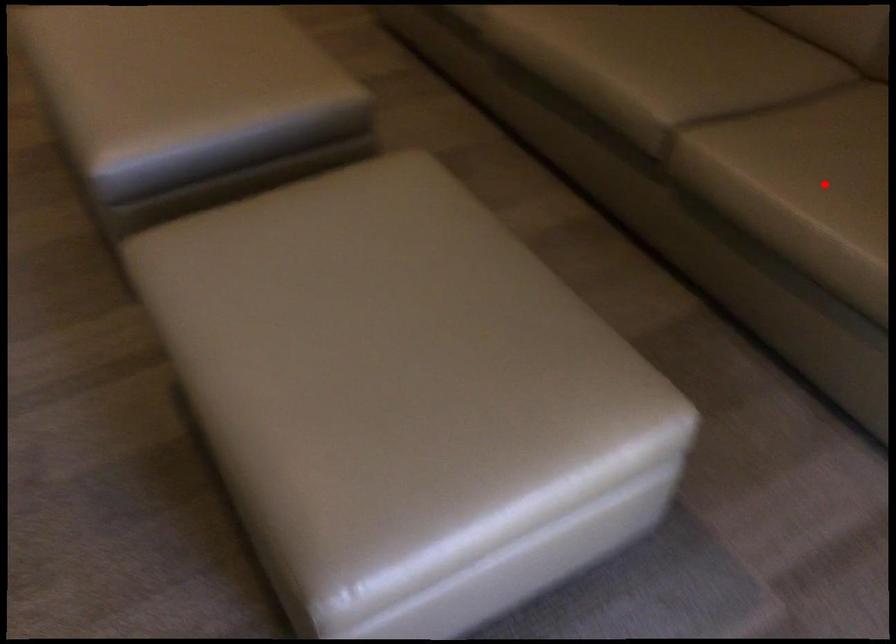
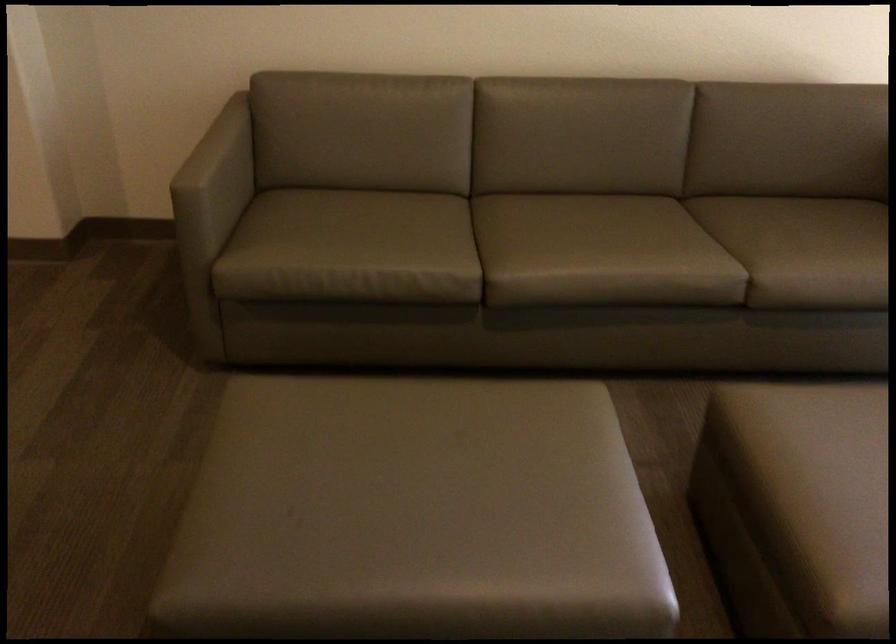
Question: I am providing you with two images of the same scene from different viewpoints. A red point is shown in image1. For the corresponding object point in image2, is it positioned nearer or farther from the camera?

Choices:
 (A) Nearer
 (B) Farther

Answer: (B)